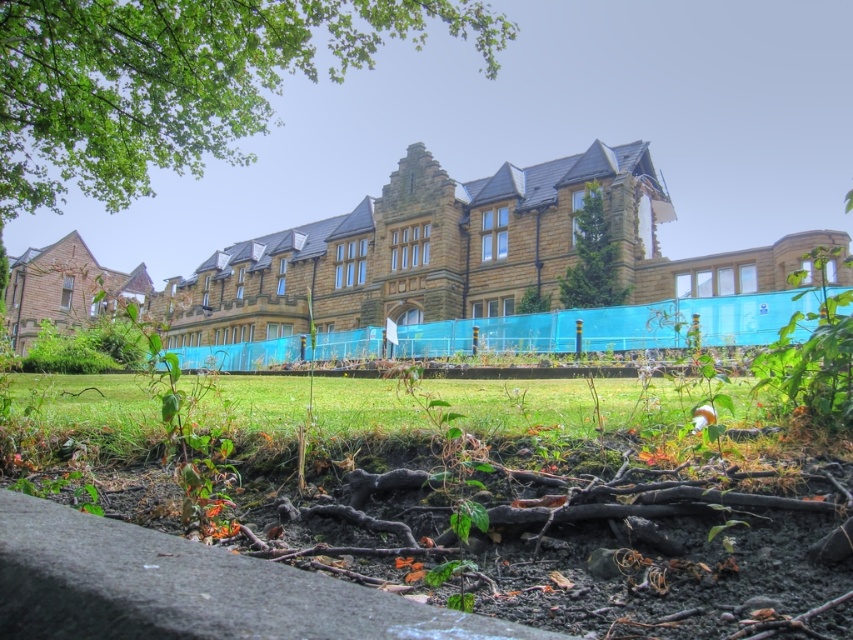
Question: Which object appears farthest from the camera in this image?

Choices:
 (A) green textured tree at center
 (B) green leafy tree at upper left

Answer: (A)

Question: Where is green leafy tree at upper left located in relation to green textured tree at center in the image?

Choices:
 (A) right
 (B) left

Answer: (B)

Question: Does green leafy tree at upper left have a larger size compared to green textured tree at center?

Choices:
 (A) no
 (B) yes

Answer: (B)

Question: Does green leafy tree at upper left come in front of green textured tree at center?

Choices:
 (A) yes
 (B) no

Answer: (A)